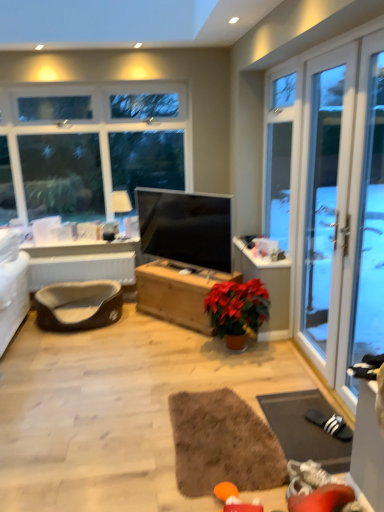
Find the location of a particular element. The height and width of the screenshot is (512, 384). empty space that is to the right of brown plush pet bed at lower left is located at coordinates (141, 329).